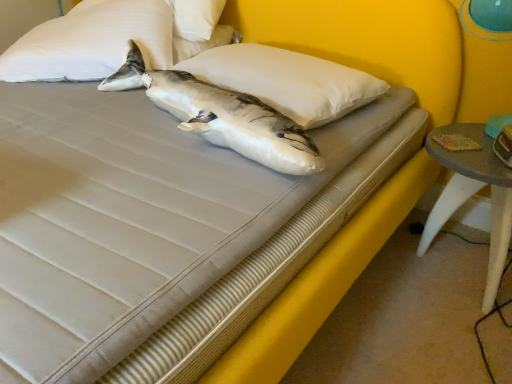
Question: Is white matte shark at center at the back of yellow fabric bed frame at center?

Choices:
 (A) no
 (B) yes

Answer: (A)

Question: Is the position of yellow fabric bed frame at center less distant than that of white matte shark at center?

Choices:
 (A) no
 (B) yes

Answer: (B)

Question: From a real-world perspective, is yellow fabric bed frame at center under white matte shark at center?

Choices:
 (A) yes
 (B) no

Answer: (A)

Question: Does yellow fabric bed frame at center have a larger size compared to white matte shark at center?

Choices:
 (A) yes
 (B) no

Answer: (A)

Question: From the image's perspective, would you say yellow fabric bed frame at center is shown under white matte shark at center?

Choices:
 (A) yes
 (B) no

Answer: (A)

Question: From their relative heights in the image, would you say white matte shark at center is taller or shorter than smooth gray table at lower right?

Choices:
 (A) short
 (B) tall

Answer: (A)

Question: Considering the positions of point (283, 170) and point (500, 180), is point (283, 170) closer or farther from the camera than point (500, 180)?

Choices:
 (A) farther
 (B) closer

Answer: (B)

Question: In the image, is white matte shark at center on the left side or the right side of smooth gray table at lower right?

Choices:
 (A) left
 (B) right

Answer: (A)

Question: Relative to smooth gray table at lower right, is white matte shark at center in front or behind?

Choices:
 (A) front
 (B) behind

Answer: (A)

Question: From a real-world perspective, is white soft pillow at center, arranged as the 2th pillow when viewed from the left, positioned above or below smooth gray table at lower right?

Choices:
 (A) above
 (B) below

Answer: (A)

Question: Visually, is white soft pillow at center, arranged as the 2th pillow when viewed from the left, positioned to the left or to the right of smooth gray table at lower right?

Choices:
 (A) left
 (B) right

Answer: (A)

Question: From the image's perspective, is white soft pillow at center, arranged as the 2th pillow when viewed from the left, above or below smooth gray table at lower right?

Choices:
 (A) below
 (B) above

Answer: (B)

Question: In terms of width, does white soft pillow at center, positioned as the first pillow in right-to-left order, look wider or thinner when compared to smooth gray table at lower right?

Choices:
 (A) wide
 (B) thin

Answer: (A)

Question: Do you think white matte shark at center is within yellow fabric bed frame at center, or outside of it?

Choices:
 (A) inside
 (B) outside

Answer: (B)

Question: Is white matte shark at center taller or shorter than yellow fabric bed frame at center?

Choices:
 (A) short
 (B) tall

Answer: (B)